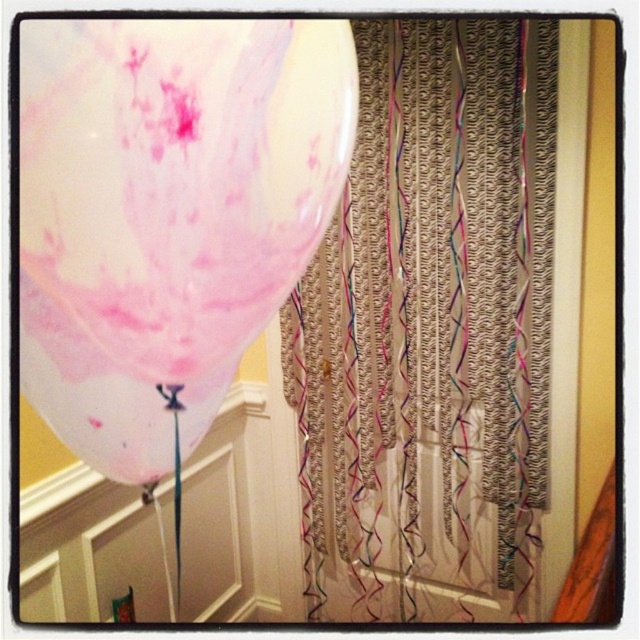
Based on the photo, which is above, textured beige curtain at center or translucent pink balloon at upper left?

translucent pink balloon at upper left

From the picture: Does textured beige curtain at center appear under translucent pink balloon at upper left?

Yes.

Does point (346, 564) come in front of point (157, 438)?

No, it is not.

The image size is (640, 640). I want to click on textured beige curtain at center, so click(432, 330).